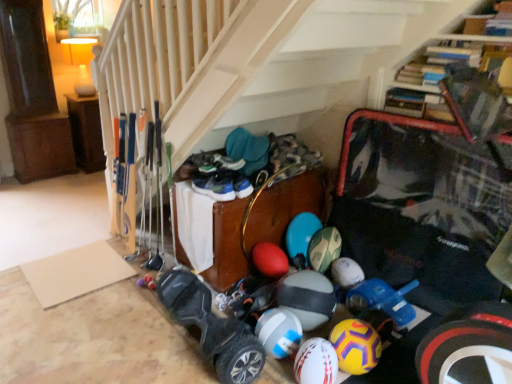
Question: Is white matte bowling ball at center, which is counted as the first bowling ball, starting from the left, located within brown wood cabinet at left, which is the 1th furniture from left to right?

Choices:
 (A) yes
 (B) no

Answer: (B)

Question: Is brown wood cabinet at left, which is the 1th furniture from top to bottom, facing towards white matte bowling ball at center, which is counted as the first bowling ball, starting from the left?

Choices:
 (A) no
 (B) yes

Answer: (B)

Question: Can you confirm if brown wood cabinet at left, which is the 2th furniture in right-to-left order, is wider than white matte bowling ball at center, which is counted as the first bowling ball, starting from the left?

Choices:
 (A) yes
 (B) no

Answer: (A)

Question: Is the depth of brown wood cabinet at left, positioned as the second furniture in bottom-to-top order, less than that of white matte bowling ball at center, which ranks as the 3th bowling ball in right-to-left order?

Choices:
 (A) yes
 (B) no

Answer: (B)

Question: Considering the relative sizes of brown wood cabinet at left, which is the 2th furniture in right-to-left order, and white matte bowling ball at center, which ranks as the 3th bowling ball in right-to-left order, in the image provided, is brown wood cabinet at left, which is the 2th furniture in right-to-left order, shorter than white matte bowling ball at center, which ranks as the 3th bowling ball in right-to-left order,?

Choices:
 (A) no
 (B) yes

Answer: (A)

Question: In terms of width, does white matte bowling ball at lower center, which is counted as the third bowling ball, starting from the left, look wider or thinner when compared to black rubber hoverboard at lower center?

Choices:
 (A) wide
 (B) thin

Answer: (B)

Question: Relative to black rubber hoverboard at lower center, is white matte bowling ball at lower center, which is counted as the third bowling ball, starting from the left, in front or behind?

Choices:
 (A) front
 (B) behind

Answer: (B)

Question: Considering the positions of point (353, 364) and point (249, 375), is point (353, 364) closer or farther from the camera than point (249, 375)?

Choices:
 (A) closer
 (B) farther

Answer: (B)

Question: Is white matte bowling ball at lower center, placed as the 1th bowling ball when sorted from right to left, taller or shorter than black rubber hoverboard at lower center?

Choices:
 (A) short
 (B) tall

Answer: (A)

Question: In the image, is white matte bowling ball at lower center, which is counted as the third bowling ball, starting from the left, positioned in front of or behind white matte bowling ball at center, acting as the 2th bowling ball starting from the left?

Choices:
 (A) front
 (B) behind

Answer: (B)

Question: From the image's perspective, is white matte bowling ball at lower center, placed as the 1th bowling ball when sorted from right to left, above or below white matte bowling ball at center, acting as the 2th bowling ball starting from the left?

Choices:
 (A) above
 (B) below

Answer: (A)

Question: Is white matte bowling ball at lower center, placed as the 1th bowling ball when sorted from right to left, inside or outside of white matte bowling ball at center, acting as the 2th bowling ball starting from the left?

Choices:
 (A) outside
 (B) inside

Answer: (A)

Question: Visually, is white matte bowling ball at lower center, placed as the 1th bowling ball when sorted from right to left, positioned to the left or to the right of white matte bowling ball at center, acting as the 2th bowling ball starting from the left?

Choices:
 (A) right
 (B) left

Answer: (A)

Question: Do you think white rubber beach ball at center is within white matte bowling ball at center, acting as the 2th bowling ball starting from the left, or outside of it?

Choices:
 (A) inside
 (B) outside

Answer: (B)

Question: Looking at their shapes, would you say white rubber beach ball at center is wider or thinner than white matte bowling ball at center, acting as the 2th bowling ball starting from the left?

Choices:
 (A) wide
 (B) thin

Answer: (A)